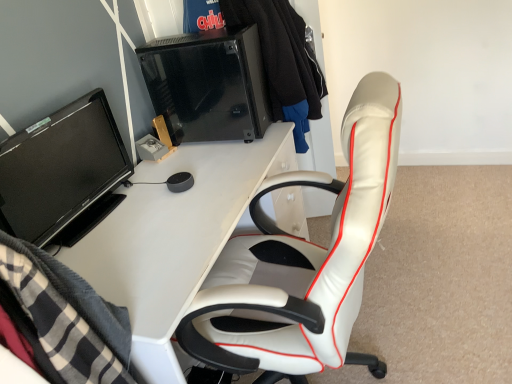
Question: Is black glass desktop computer at upper center inside black fabric jacket at upper center?

Choices:
 (A) yes
 (B) no

Answer: (B)

Question: Is black fabric jacket at upper center turned away from black glass desktop computer at upper center?

Choices:
 (A) no
 (B) yes

Answer: (A)

Question: Is black fabric jacket at upper center in front of black glass desktop computer at upper center?

Choices:
 (A) no
 (B) yes

Answer: (A)

Question: Is black fabric jacket at upper center facing towards black glass desktop computer at upper center?

Choices:
 (A) yes
 (B) no

Answer: (B)

Question: Considering the relative sizes of black fabric jacket at upper center and black glass desktop computer at upper center in the image provided, is black fabric jacket at upper center taller than black glass desktop computer at upper center?

Choices:
 (A) yes
 (B) no

Answer: (A)

Question: In terms of size, does black fabric jacket at upper center appear bigger or smaller than white glossy desk at center?

Choices:
 (A) small
 (B) big

Answer: (A)

Question: Relative to white glossy desk at center, is black fabric jacket at upper center in front or behind?

Choices:
 (A) front
 (B) behind

Answer: (B)

Question: From a real-world perspective, relative to white glossy desk at center, is black fabric jacket at upper center vertically above or below?

Choices:
 (A) below
 (B) above

Answer: (B)

Question: From the image's perspective, is black fabric jacket at upper center positioned above or below white glossy desk at center?

Choices:
 (A) above
 (B) below

Answer: (A)

Question: Considering their positions, is black glass desktop computer at upper center located in front of or behind black glossy monitor at left?

Choices:
 (A) behind
 (B) front

Answer: (A)

Question: Does point (245, 112) appear closer or farther from the camera than point (108, 178)?

Choices:
 (A) closer
 (B) farther

Answer: (B)

Question: Based on their positions, is black glass desktop computer at upper center located to the left or right of black glossy monitor at left?

Choices:
 (A) left
 (B) right

Answer: (B)

Question: In terms of width, does black glass desktop computer at upper center look wider or thinner when compared to black glossy monitor at left?

Choices:
 (A) thin
 (B) wide

Answer: (B)

Question: Considering the positions of white glossy desk at center and black fabric jacket at upper center in the image, is white glossy desk at center taller or shorter than black fabric jacket at upper center?

Choices:
 (A) short
 (B) tall

Answer: (B)

Question: Is point (214, 221) closer or farther from the camera than point (303, 36)?

Choices:
 (A) farther
 (B) closer

Answer: (B)